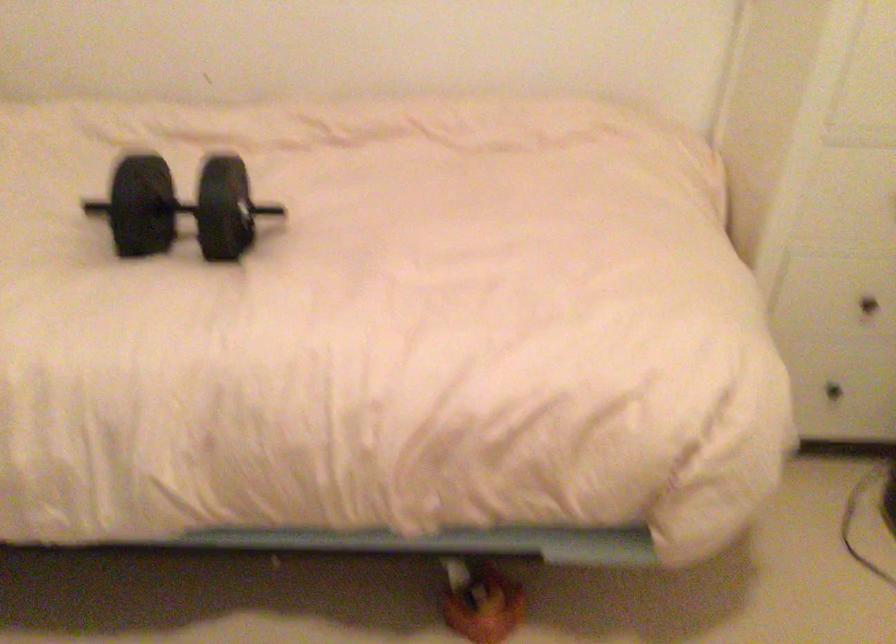
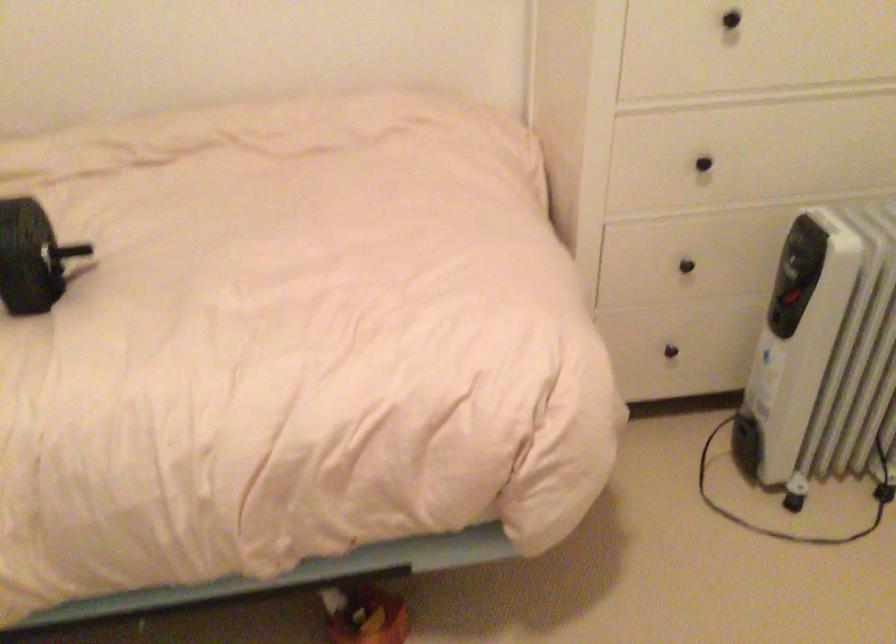
Question: The camera is either moving clockwise (left) or counter-clockwise (right) around the object. The first image is from the beginning of the video and the second image is from the end. Is the camera moving left or right when shooting the video?

Choices:
 (A) Left
 (B) Right

Answer: (A)